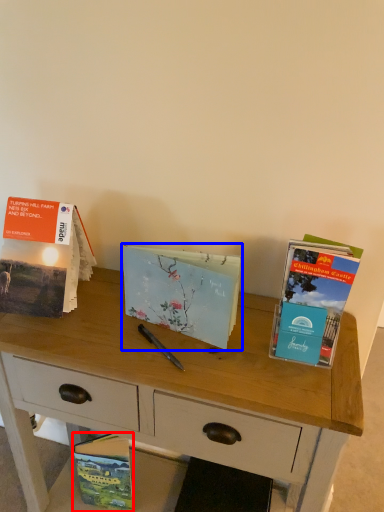
Question: Which object appears farthest to the camera in this image, book (highlighted by a red box) or book (highlighted by a blue box)?

Choices:
 (A) book
 (B) book

Answer: (A)